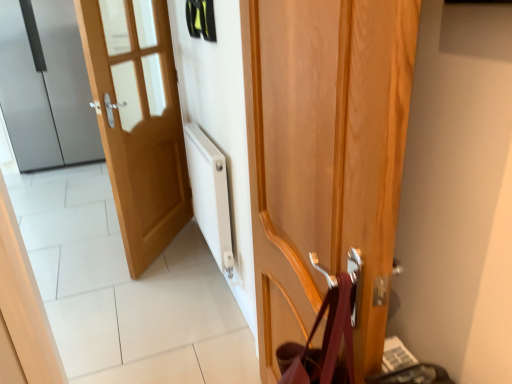
Question: Should I look upward or downward to see wooden door at center, marked as the first door in a front-to-back arrangement?

Choices:
 (A) up
 (B) down

Answer: (B)

Question: Is satin silver refrigerator at left, positioned as the 3th door in right-to-left order, surrounded by wooden door at center, arranged as the 3th door when viewed from the back?

Choices:
 (A) no
 (B) yes

Answer: (A)

Question: From the image's perspective, is wooden door at center, marked as the first door in a front-to-back arrangement, located beneath satin silver refrigerator at left, the first door when ordered from back to front?

Choices:
 (A) no
 (B) yes

Answer: (B)

Question: Is wooden door at center, which ranks as the 3th door in left-to-right order, not inside satin silver refrigerator at left, the first door when ordered from back to front?

Choices:
 (A) yes
 (B) no

Answer: (A)

Question: Is wooden door at center, marked as the first door in a right-to-left arrangement, positioned behind satin silver refrigerator at left, the first door when ordered from back to front?

Choices:
 (A) no
 (B) yes

Answer: (A)

Question: From a real-world perspective, is wooden door at center, marked as the first door in a front-to-back arrangement, located higher than satin silver refrigerator at left, marked as the third door in a front-to-back arrangement?

Choices:
 (A) no
 (B) yes

Answer: (A)

Question: Considering the relative sizes of wooden door at center, which ranks as the 3th door in left-to-right order, and satin silver refrigerator at left, marked as the third door in a front-to-back arrangement, in the image provided, is wooden door at center, which ranks as the 3th door in left-to-right order, smaller than satin silver refrigerator at left, marked as the third door in a front-to-back arrangement,?

Choices:
 (A) yes
 (B) no

Answer: (A)

Question: Is there a large distance between light wood door at left, which appears as the 2th door when viewed from the back, and satin silver refrigerator at left, marked as the third door in a front-to-back arrangement?

Choices:
 (A) yes
 (B) no

Answer: (A)

Question: Is light wood door at left, which appears as the second door when viewed from the front, at the right side of satin silver refrigerator at left, which is the 1th door from left to right?

Choices:
 (A) no
 (B) yes

Answer: (B)

Question: From a real-world perspective, is light wood door at left, which appears as the 2th door when viewed from the back, over satin silver refrigerator at left, which is the 1th door from left to right?

Choices:
 (A) yes
 (B) no

Answer: (B)

Question: From the image's perspective, is light wood door at left, which appears as the second door when viewed from the front, above satin silver refrigerator at left, marked as the third door in a front-to-back arrangement?

Choices:
 (A) no
 (B) yes

Answer: (A)

Question: Would you say light wood door at left, the 2th door viewed from the right, contains satin silver refrigerator at left, which is the 1th door from left to right?

Choices:
 (A) no
 (B) yes

Answer: (A)

Question: Does light wood door at left, positioned as the 2th door in left-to-right order, have a greater width compared to satin silver refrigerator at left, the first door when ordered from back to front?

Choices:
 (A) no
 (B) yes

Answer: (A)

Question: Is wooden door at center, marked as the first door in a right-to-left arrangement, inside satin silver refrigerator at left, the first door when ordered from back to front?

Choices:
 (A) no
 (B) yes

Answer: (A)